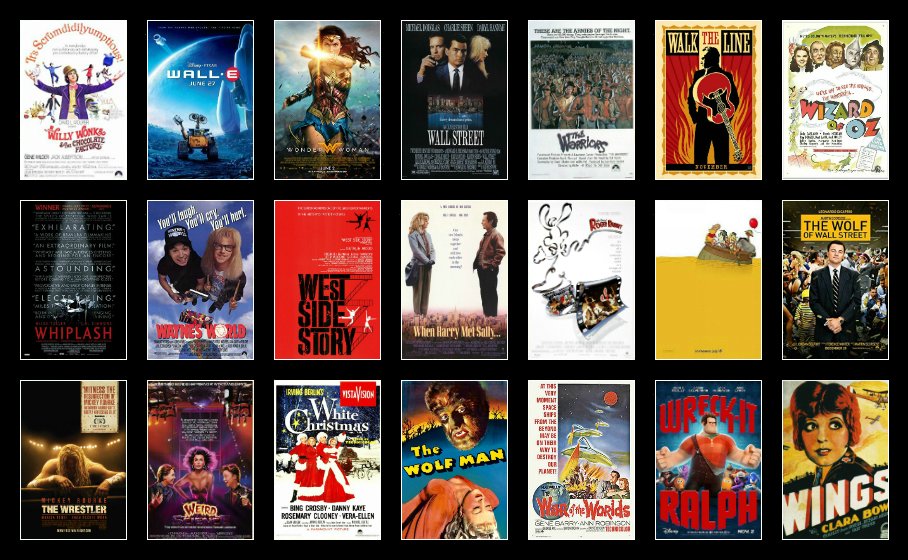
Where is `movie posters on the top row`? The width and height of the screenshot is (908, 560). movie posters on the top row is located at coordinates (72, 113), (192, 108), (332, 113), (475, 108), (604, 88), (723, 108), (880, 113).